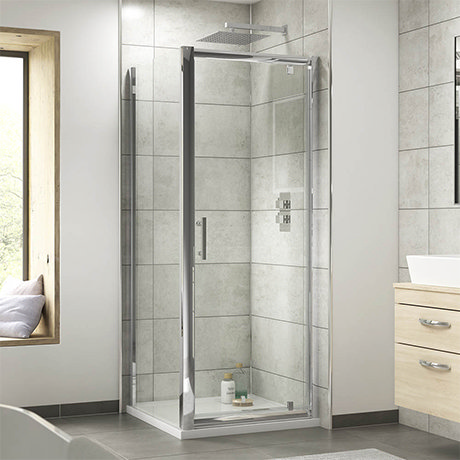
Where is `wall`? wall is located at coordinates (89, 323).